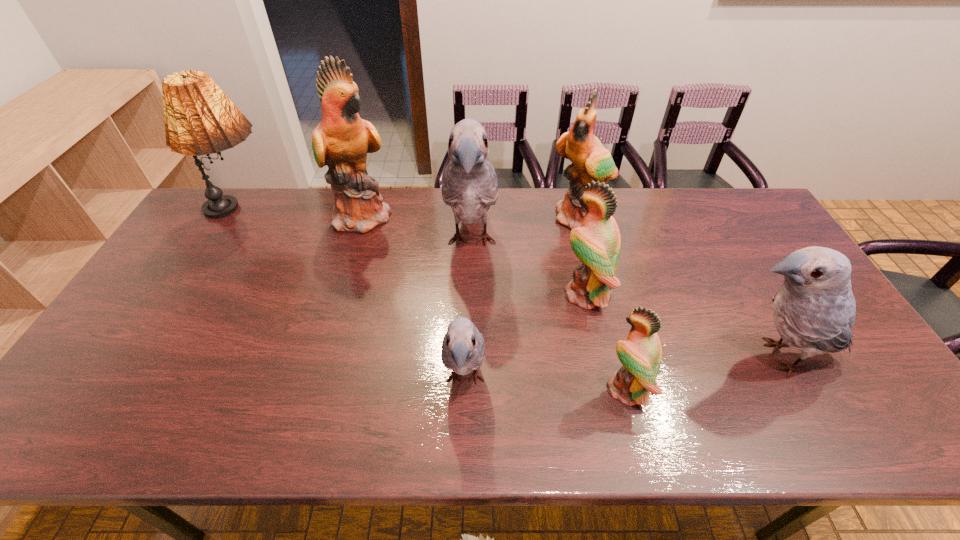
At what (x,y) coordinates should I click in order to perform the action: click on vacant space located on the front-facing side of the second object from left to right. Please return your answer as a coordinate pair (x, y). Image resolution: width=960 pixels, height=540 pixels. Looking at the image, I should click on (468, 215).

You are a GUI agent. You are given a task and a screenshot of the screen. Output one action in this format:
    pyautogui.click(x=<x>, y=<y>)
    Task: Click on the vacant space located 0.230m on the front-facing side of the lampshade
    This screenshot has height=540, width=960.
    Given the screenshot: What is the action you would take?
    pyautogui.click(x=348, y=213)

Find the location of `blank space located on the front-facing side of the third smallest green parrot`. blank space located on the front-facing side of the third smallest green parrot is located at coordinates (604, 315).

Find the location of `vacant space located on the front-facing side of the biggest gray parrot`. vacant space located on the front-facing side of the biggest gray parrot is located at coordinates (469, 340).

Locate an element on the screen. free spot located on the front-facing side of the third farthest green parrot is located at coordinates (501, 294).

Locate an element on the screen. This screenshot has height=540, width=960. vacant position located on the front-facing side of the third farthest green parrot is located at coordinates (469, 294).

Where is `vacant space situated 0.120m on the front-facing side of the third farthest green parrot`? vacant space situated 0.120m on the front-facing side of the third farthest green parrot is located at coordinates (518, 294).

The width and height of the screenshot is (960, 540). In order to click on free location located 0.380m on the front-facing side of the second biggest gray parrot in this screenshot , I will do `click(564, 357)`.

Identify the location of free space located 0.360m on the front-facing side of the second biggest gray parrot. (571, 357).

Where is `vacant region located 0.160m on the front-facing side of the second biggest gray parrot`? vacant region located 0.160m on the front-facing side of the second biggest gray parrot is located at coordinates (651, 357).